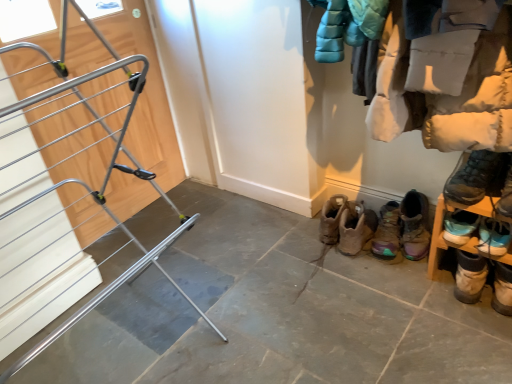
I want to click on free space to the left of light brown suede boot at lower right, the 2th footwear in the right-to-left sequence, so [417, 299].